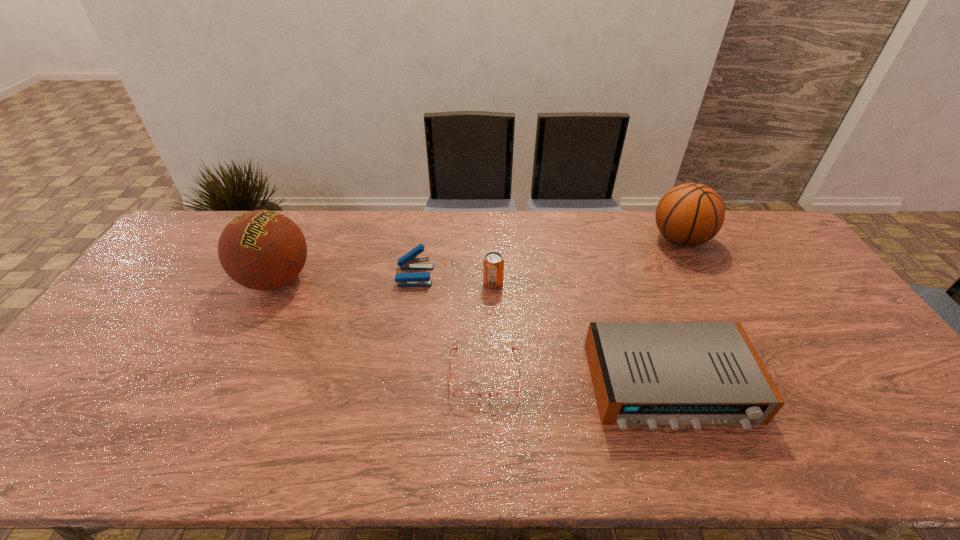
Where is `vacant area situated on the control panel of the radio receiver`? vacant area situated on the control panel of the radio receiver is located at coordinates (697, 458).

Identify the location of vacant area located 0.060m on the back of the stapler. Image resolution: width=960 pixels, height=540 pixels. (419, 253).

In order to click on vacant area situated 0.100m on the lenses of the shortest object in this screenshot , I will do `click(486, 444)`.

The width and height of the screenshot is (960, 540). I want to click on object that is at the far edge, so click(x=690, y=214).

This screenshot has width=960, height=540. I want to click on object at the near edge, so click(x=644, y=373).

At what (x,y) coordinates should I click in order to perform the action: click on vacant space at the far edge of the desktop. Please return your answer as a coordinate pair (x, y). The image size is (960, 540). Looking at the image, I should click on (524, 225).

I want to click on vacant space at the near edge of the desktop, so click(x=346, y=454).

The image size is (960, 540). In the image, there is a desktop. Find the location of `vacant space at the right edge`. vacant space at the right edge is located at coordinates (825, 335).

This screenshot has height=540, width=960. In order to click on vacant space at the far left corner of the desktop in this screenshot , I will do `click(197, 226)`.

The image size is (960, 540). In the image, there is a desktop. Find the location of `vacant space at the far right corner`. vacant space at the far right corner is located at coordinates (750, 232).